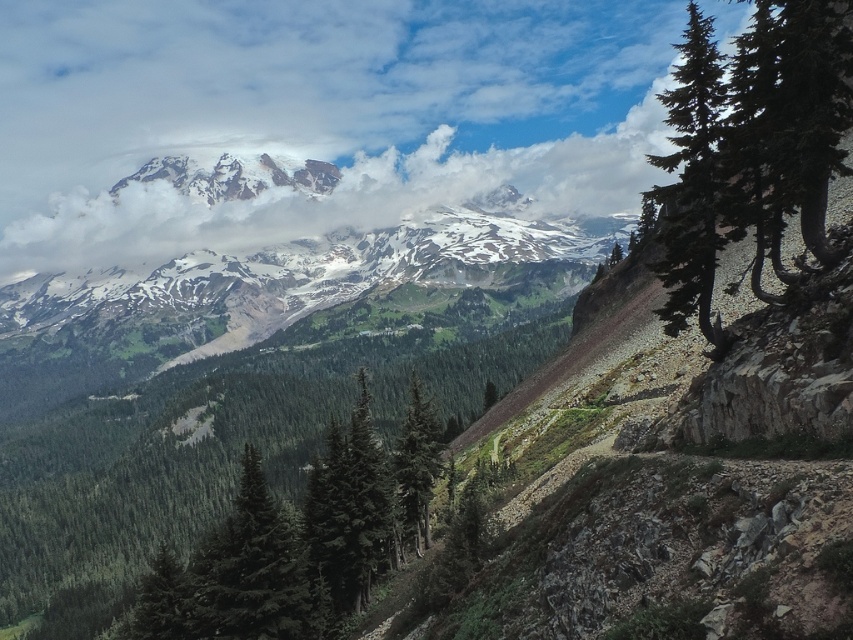
Question: Does green rough bark tree at upper right have a lesser width compared to green textured tree at right?

Choices:
 (A) yes
 (B) no

Answer: (B)

Question: Which of the following is the closest to the observer?

Choices:
 (A) green matte tree at center
 (B) green rough bark tree at upper right
 (C) green textured tree at right

Answer: (B)

Question: Which is farther from the green matte tree at center?

Choices:
 (A) green textured tree at right
 (B) snowy rocky mountain range at upper center

Answer: (B)

Question: Can you confirm if green rough bark tree at upper right is positioned above green matte tree at center?

Choices:
 (A) yes
 (B) no

Answer: (A)

Question: Which of the following is the farthest from the observer?

Choices:
 (A) green rough bark tree at upper right
 (B) green matte tree at center
 (C) green textured tree at right

Answer: (B)

Question: Can you confirm if green rough bark tree at upper right is positioned to the right of green matte tree at center?

Choices:
 (A) yes
 (B) no

Answer: (A)